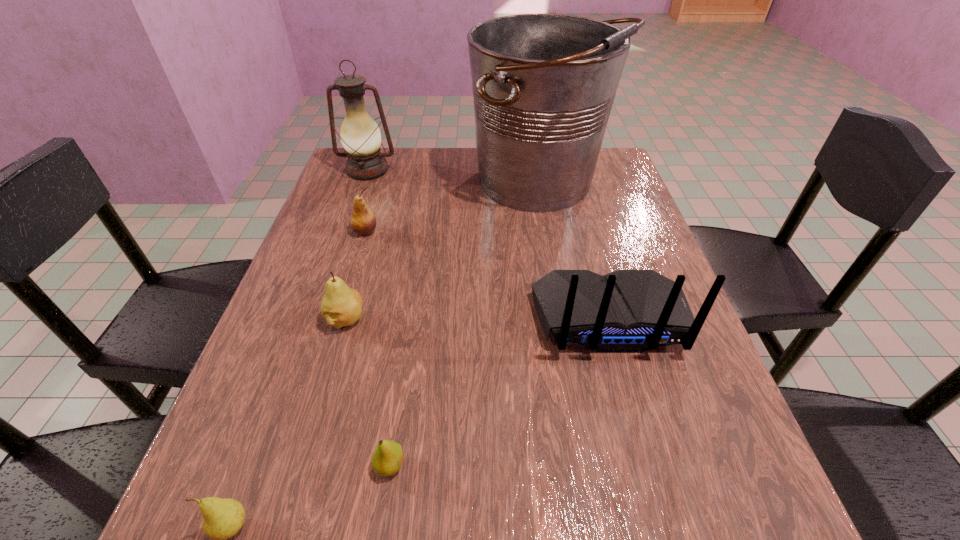
This screenshot has height=540, width=960. What are the coordinates of `free spot at the far edge of the desktop` in the screenshot? It's located at (452, 157).

At what (x,y) coordinates should I click in order to perform the action: click on free space at the near edge of the desktop. Please return your answer as a coordinate pair (x, y). Looking at the image, I should click on (546, 510).

In the image, there is a desktop. Find the location of `free space at the left edge`. free space at the left edge is located at coordinates (359, 253).

In the image, there is a desktop. At what (x,y) coordinates should I click in order to perform the action: click on vacant region at the right edge. Please return your answer as a coordinate pair (x, y). The width and height of the screenshot is (960, 540). Looking at the image, I should click on (707, 461).

Where is `free location at the far left corner of the desktop`? Image resolution: width=960 pixels, height=540 pixels. free location at the far left corner of the desktop is located at coordinates (384, 179).

Where is `free space at the far right corner`? Image resolution: width=960 pixels, height=540 pixels. free space at the far right corner is located at coordinates (608, 171).

Identify the location of vacant area between the farthest pear and the oil lamp. The image size is (960, 540). (367, 201).

Image resolution: width=960 pixels, height=540 pixels. Find the location of `vacant area that lies between the bucket and the third farthest pear`. vacant area that lies between the bucket and the third farthest pear is located at coordinates (466, 325).

You are a GUI agent. You are given a task and a screenshot of the screen. Output one action in this format:
    pyautogui.click(x=<x>, y=<y>)
    Task: Click on the free spot between the router and the oil lamp
    
    Given the screenshot: What is the action you would take?
    pyautogui.click(x=489, y=244)

Locate an element on the screen. This screenshot has width=960, height=540. vacant space that's between the farthest pear and the third farthest pear is located at coordinates (377, 348).